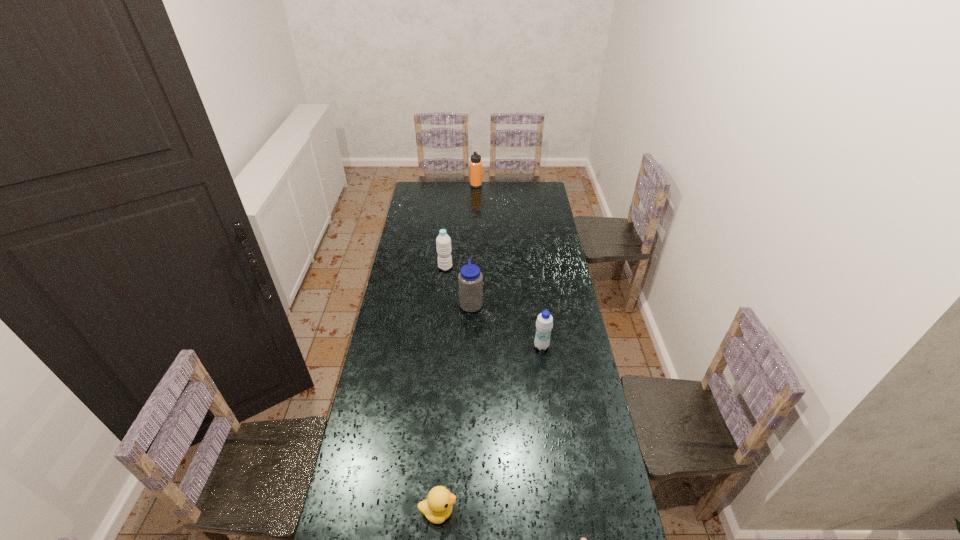
Locate an element on the screen. thermos bottle is located at coordinates (475, 164).

The image size is (960, 540). I want to click on the leftmost water bottle, so click(443, 242).

Find the location of a particular element. The height and width of the screenshot is (540, 960). the farthest water bottle is located at coordinates (443, 242).

The image size is (960, 540). In order to click on the second water bottle from left to right in this screenshot , I will do `click(470, 280)`.

The image size is (960, 540). Find the location of `the second farthest water bottle`. the second farthest water bottle is located at coordinates (470, 280).

The width and height of the screenshot is (960, 540). In order to click on the third nearest object in this screenshot , I will do `click(544, 323)`.

Locate an element on the screen. the rightmost water bottle is located at coordinates (544, 323).

You are a GUI agent. You are given a task and a screenshot of the screen. Output one action in this format:
    pyautogui.click(x=<x>, y=<y>)
    Task: Click on the second nearest object
    Image resolution: width=960 pixels, height=540 pixels.
    Given the screenshot: What is the action you would take?
    tap(437, 507)

Image resolution: width=960 pixels, height=540 pixels. Identify the location of free point located on the front of the thermos bottle. (476, 195).

The height and width of the screenshot is (540, 960). Find the location of `free space located on the right of the farthest water bottle`. free space located on the right of the farthest water bottle is located at coordinates (476, 267).